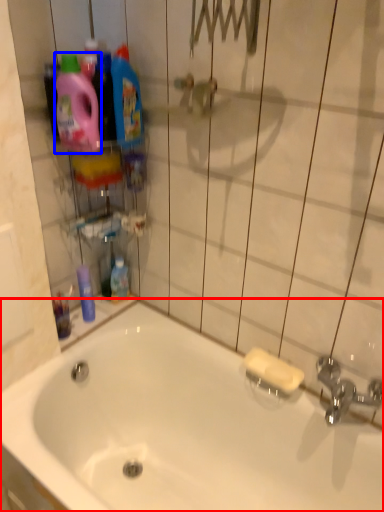
Question: Which point is further to the camera, bathtub (highlighted by a red box) or cleaning product (highlighted by a blue box)?

Choices:
 (A) bathtub
 (B) cleaning product

Answer: (B)